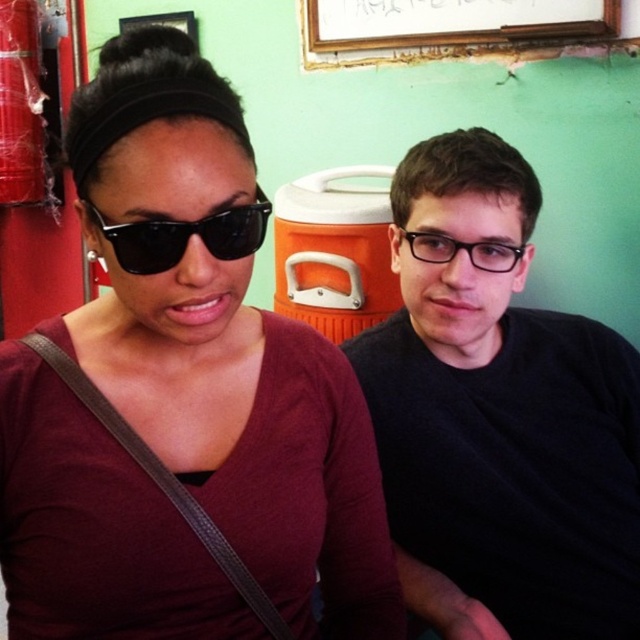
Looking at the scene, where is the wooden frame at upper center in relation to the black plastic glasses at right?

The wooden frame at upper center is to the right of the black plastic glasses at right.

You are an interior designer assessing the wall decorations in the scene. You need to determine if the wooden frame at upper center can be placed above the black plastic glasses at right without overlapping. Can it fit vertically?

The wooden frame at upper center is taller than the black plastic glasses at right, so it can be placed above them without overlapping vertically as it has sufficient height difference.

You are trying to decide which pair of glasses to take for your hike. You see the black matte glasses at upper right and the black plastic glasses at right. Which one has a bigger frame?

The black matte glasses at upper right has a larger frame than the black plastic glasses at right because it is larger in size than the black plastic glasses at right.